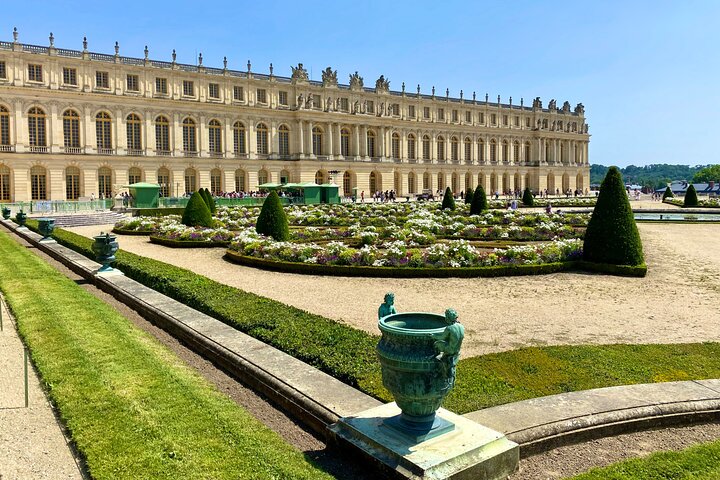
Image resolution: width=720 pixels, height=480 pixels. I want to click on windows, so click(477, 150).